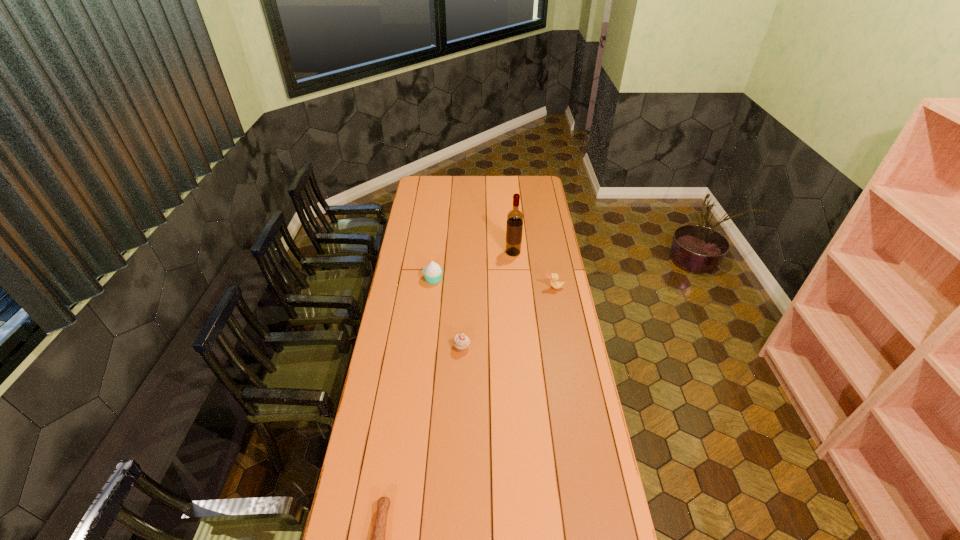
In order to click on the tallest object in this screenshot , I will do `click(514, 228)`.

Where is `the second object from right to left`? This screenshot has width=960, height=540. the second object from right to left is located at coordinates (514, 228).

I want to click on the left cupcake, so click(x=433, y=272).

The height and width of the screenshot is (540, 960). Identify the location of the second tallest object. (433, 272).

You are a GUI agent. You are given a task and a screenshot of the screen. Output one action in this format:
    pyautogui.click(x=<x>, y=<y>)
    Task: Click on the rightmost object
    The height and width of the screenshot is (540, 960).
    Given the screenshot: What is the action you would take?
    pyautogui.click(x=554, y=277)

Identify the location of the third object from left to right. (461, 342).

Find the location of a particular element. This screenshot has width=960, height=540. the fourth farthest object is located at coordinates (461, 342).

Locate an element on the screen. vacant space located 0.370m on the front of the second object from right to left is located at coordinates (518, 308).

Find the location of a particular element. The width and height of the screenshot is (960, 540). free space located 0.140m on the front of the fourth shortest object is located at coordinates (430, 306).

The image size is (960, 540). I want to click on free location located 0.180m on the beak of the duck, so click(x=559, y=318).